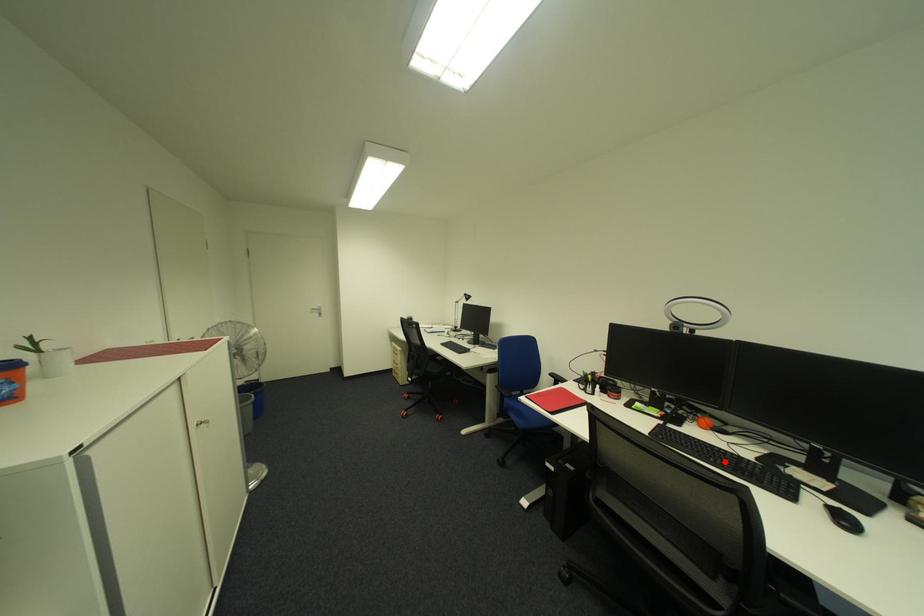
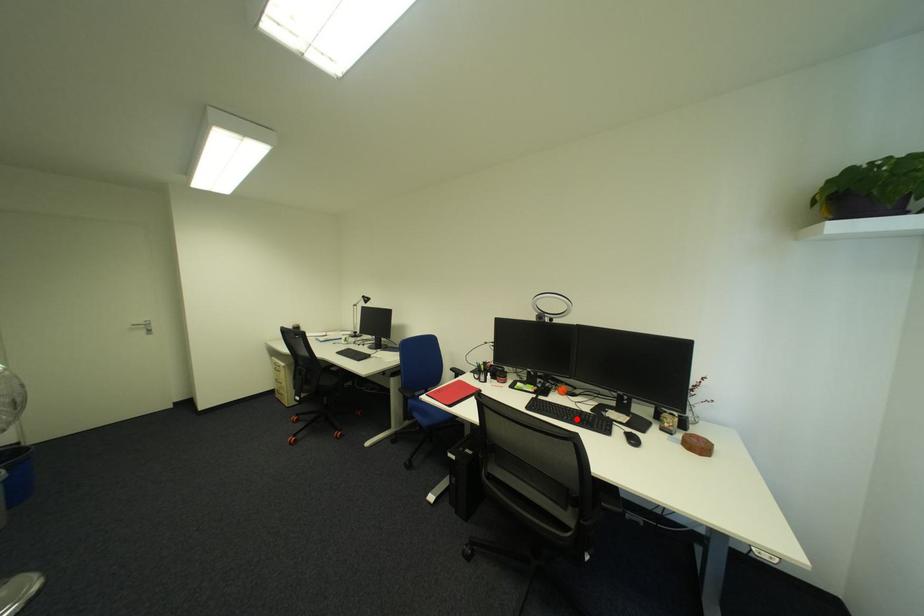
Consider the image. I am providing you with two images of the same scene from different viewpoints. A red point is marked on the first image and another point is marked on the second image. Are the points marked in image1 and image2 representing the same 3D position?

Yes